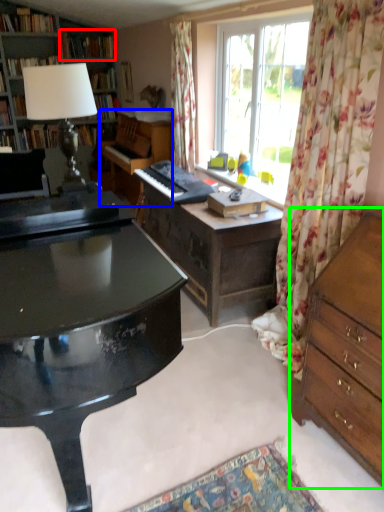
Question: Which object is positioned farthest from book (highlighted by a red box)? Select from piano (highlighted by a blue box) and chest of drawers (highlighted by a green box).

Choices:
 (A) piano
 (B) chest of drawers

Answer: (B)